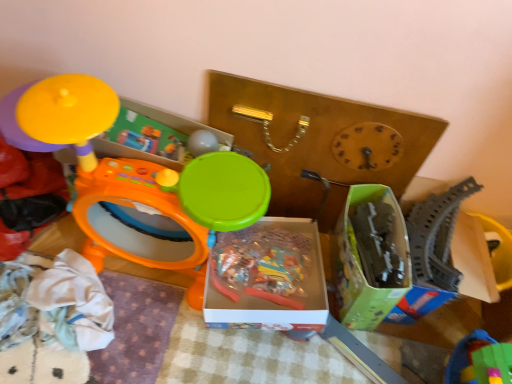
Question: Does gray plastic train track at right, positioned as the first toy in right-to-left order, have a larger size compared to orange plastic drum at left, positioned as the 2th toy in left-to-right order?

Choices:
 (A) yes
 (B) no

Answer: (B)

Question: Is gray plastic train track at right, which is the 4th toy in left-to-right order, outside of orange plastic drum at left, positioned as the 2th toy in left-to-right order?

Choices:
 (A) yes
 (B) no

Answer: (A)

Question: Are gray plastic train track at right, which is the 4th toy in left-to-right order, and orange plastic drum at left, the 3th toy viewed from the right, beside each other?

Choices:
 (A) no
 (B) yes

Answer: (A)

Question: Does gray plastic train track at right, positioned as the first toy in right-to-left order, have a greater height compared to orange plastic drum at left, positioned as the 2th toy in left-to-right order?

Choices:
 (A) no
 (B) yes

Answer: (A)

Question: Is gray plastic train track at right, positioned as the first toy in right-to-left order, not close to orange plastic drum at left, positioned as the 2th toy in left-to-right order?

Choices:
 (A) yes
 (B) no

Answer: (B)

Question: Would you say matte yellow toy at upper left, placed as the 1th toy when sorted from left to right, is inside or outside orange plastic drum at left, positioned as the 2th toy in left-to-right order?

Choices:
 (A) outside
 (B) inside

Answer: (A)

Question: Considering the relative positions of matte yellow toy at upper left, placed as the 1th toy when sorted from left to right, and orange plastic drum at left, positioned as the 2th toy in left-to-right order, in the image provided, is matte yellow toy at upper left, placed as the 1th toy when sorted from left to right, to the left or to the right of orange plastic drum at left, positioned as the 2th toy in left-to-right order,?

Choices:
 (A) right
 (B) left

Answer: (B)

Question: From a real-world perspective, is matte yellow toy at upper left, placed as the 1th toy when sorted from left to right, above or below orange plastic drum at left, positioned as the 2th toy in left-to-right order?

Choices:
 (A) above
 (B) below

Answer: (B)

Question: Is matte yellow toy at upper left, which is the fourth toy in right-to-left order, taller or shorter than orange plastic drum at left, the 3th toy viewed from the right?

Choices:
 (A) short
 (B) tall

Answer: (A)

Question: Is green cardboard box at center-right, the 1th storage box when ordered from right to left, wider or thinner than gray plastic train track at right, which is the 4th toy in left-to-right order?

Choices:
 (A) thin
 (B) wide

Answer: (B)

Question: From a real-world perspective, relative to gray plastic train track at right, which is the 4th toy in left-to-right order, is green cardboard box at center-right, the 1th storage box when ordered from right to left, vertically above or below?

Choices:
 (A) below
 (B) above

Answer: (B)

Question: Is green cardboard box at center-right, placed as the 2th storage box when sorted from left to right, situated inside gray plastic train track at right, which is the 4th toy in left-to-right order, or outside?

Choices:
 (A) inside
 (B) outside

Answer: (B)

Question: Relative to gray plastic train track at right, which is the 4th toy in left-to-right order, is green cardboard box at center-right, placed as the 2th storage box when sorted from left to right, in front or behind?

Choices:
 (A) behind
 (B) front

Answer: (B)

Question: Do you think green plastic blocks at lower right, the 3th toy viewed from the left, is within gray plastic train track at right, positioned as the first toy in right-to-left order, or outside of it?

Choices:
 (A) inside
 (B) outside

Answer: (B)

Question: From a real-world perspective, is green plastic blocks at lower right, the 3th toy viewed from the left, above or below gray plastic train track at right, positioned as the first toy in right-to-left order?

Choices:
 (A) below
 (B) above

Answer: (B)